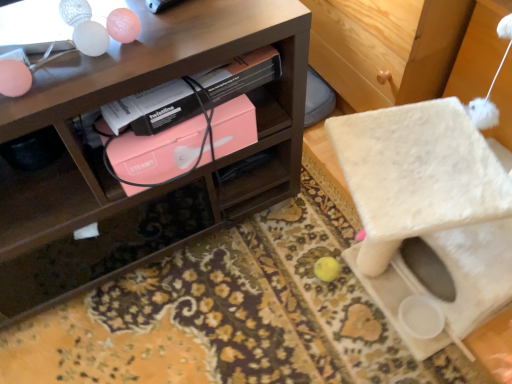
Question: From their relative heights in the image, would you say wooden shelf at upper left is taller or shorter than pink matte box at center?

Choices:
 (A) tall
 (B) short

Answer: (A)

Question: Looking at the image, does wooden shelf at upper left seem bigger or smaller compared to pink matte box at center?

Choices:
 (A) small
 (B) big

Answer: (B)

Question: Considering the real-world distances, which object is closest to the pink matte box at center?

Choices:
 (A) pink matte box at center
 (B) wooden shelf at upper left

Answer: (A)

Question: Which is nearer to the wooden shelf at upper left?

Choices:
 (A) pink matte box at center
 (B) pink matte box at center

Answer: (A)